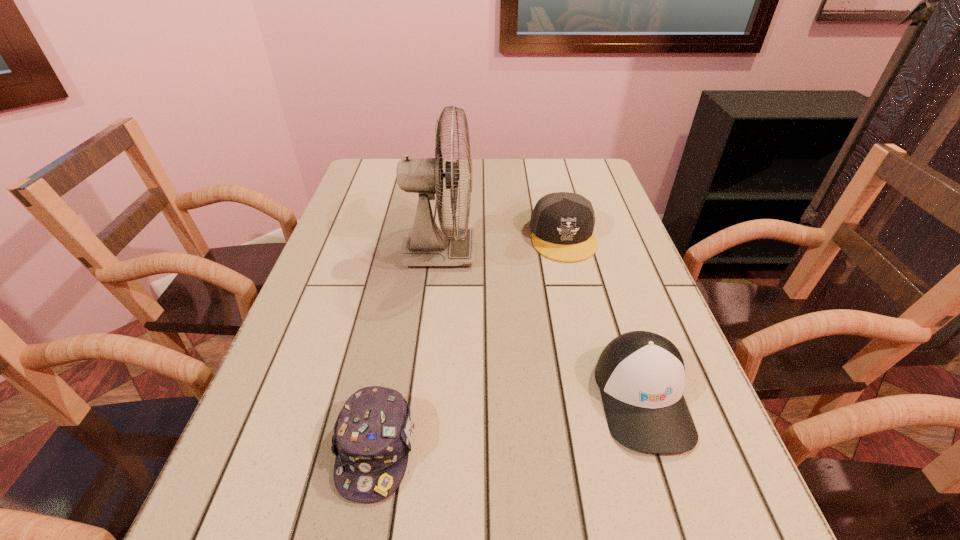
This screenshot has height=540, width=960. In order to click on free space at the far left corner of the desktop in this screenshot , I will do `click(384, 172)`.

The height and width of the screenshot is (540, 960). In order to click on blank region between the tallest object and the farthest headwear in this screenshot , I will do `click(502, 244)`.

Locate an element on the screen. The image size is (960, 540). blank region between the tallest object and the farthest headwear is located at coordinates (502, 244).

This screenshot has width=960, height=540. In order to click on free space between the tallest object and the farthest headwear in this screenshot , I will do `click(502, 244)`.

This screenshot has height=540, width=960. Find the location of `free space between the fan and the shortest headwear`. free space between the fan and the shortest headwear is located at coordinates (408, 350).

Image resolution: width=960 pixels, height=540 pixels. I want to click on free space between the fan and the shortest headwear, so click(x=408, y=350).

Identify the location of free space between the tallest object and the leftmost headwear. The height and width of the screenshot is (540, 960). (408, 350).

Image resolution: width=960 pixels, height=540 pixels. What are the coordinates of `vacant point located between the farthest headwear and the shortest object` in the screenshot? It's located at (469, 343).

What are the coordinates of `object that is the third closest to the tallest object` in the screenshot? It's located at (372, 438).

At what (x,y) coordinates should I click in order to perform the action: click on object that is the third closest to the shortest headwear. Please return your answer as a coordinate pair (x, y). This screenshot has width=960, height=540. Looking at the image, I should click on (562, 223).